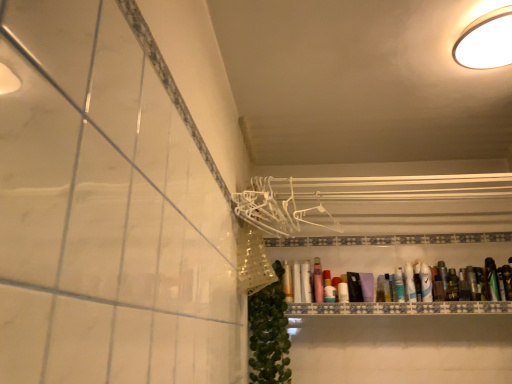
Question: Could you tell me if white glossy bottle at upper right, which ranks as the eighth toiletry in left-to-right order, is facing green matte bottle at right, the second toiletry when ordered from right to left?

Choices:
 (A) yes
 (B) no

Answer: (B)

Question: Does white glossy bottle at upper right, which ranks as the eighth toiletry in left-to-right order, have a lesser height compared to green matte bottle at right, the second toiletry when ordered from right to left?

Choices:
 (A) no
 (B) yes

Answer: (A)

Question: Is white glossy bottle at upper right, which is the fourth toiletry in right-to-left order, next to green matte bottle at right, the second toiletry when ordered from right to left?

Choices:
 (A) yes
 (B) no

Answer: (B)

Question: Can you confirm if white glossy bottle at upper right, which ranks as the eighth toiletry in left-to-right order, is bigger than green matte bottle at right, which is counted as the 10th toiletry, starting from the left?

Choices:
 (A) no
 (B) yes

Answer: (B)

Question: Considering the relative positions of white glossy bottle at upper right, which ranks as the eighth toiletry in left-to-right order, and green matte bottle at right, which is counted as the 10th toiletry, starting from the left, in the image provided, is white glossy bottle at upper right, which ranks as the eighth toiletry in left-to-right order, to the left of green matte bottle at right, which is counted as the 10th toiletry, starting from the left, from the viewer's perspective?

Choices:
 (A) no
 (B) yes

Answer: (B)

Question: Considering the positions of point (348, 299) and point (446, 279), is point (348, 299) closer or farther from the camera than point (446, 279)?

Choices:
 (A) closer
 (B) farther

Answer: (A)

Question: Considering their positions, is matte plastic bottle at center, acting as the 6th toiletry starting from the right, located in front of or behind green matte bottle at right, which is counted as the 10th toiletry, starting from the left?

Choices:
 (A) behind
 (B) front

Answer: (B)

Question: Looking at the image, does matte plastic bottle at center, acting as the 6th toiletry starting from the right, seem bigger or smaller compared to green matte bottle at right, which is counted as the 10th toiletry, starting from the left?

Choices:
 (A) small
 (B) big

Answer: (A)

Question: From a real-world perspective, is matte plastic bottle at center, acting as the 6th toiletry starting from the right, positioned above or below green matte bottle at right, which is counted as the 10th toiletry, starting from the left?

Choices:
 (A) below
 (B) above

Answer: (A)

Question: Looking at their shapes, would you say green leafy plant at lower center is wider or thinner than translucent plastic bottle at upper right, positioned as the fifth toiletry in right-to-left order?

Choices:
 (A) wide
 (B) thin

Answer: (A)

Question: Is green leafy plant at lower center to the left or to the right of translucent plastic bottle at upper right, arranged as the seventh toiletry when viewed from the left, in the image?

Choices:
 (A) right
 (B) left

Answer: (B)

Question: Based on their sizes in the image, would you say green leafy plant at lower center is bigger or smaller than translucent plastic bottle at upper right, positioned as the fifth toiletry in right-to-left order?

Choices:
 (A) small
 (B) big

Answer: (B)

Question: Which is correct: green leafy plant at lower center is inside translucent plastic bottle at upper right, arranged as the seventh toiletry when viewed from the left, or outside of it?

Choices:
 (A) inside
 (B) outside

Answer: (B)

Question: Based on their positions, is white glossy light fixture at upper right located to the left or right of matte plastic bottle at center, the 6th toiletry in the left-to-right sequence?

Choices:
 (A) right
 (B) left

Answer: (A)

Question: Relative to matte plastic bottle at center, acting as the 6th toiletry starting from the right, is white glossy light fixture at upper right in front or behind?

Choices:
 (A) front
 (B) behind

Answer: (A)